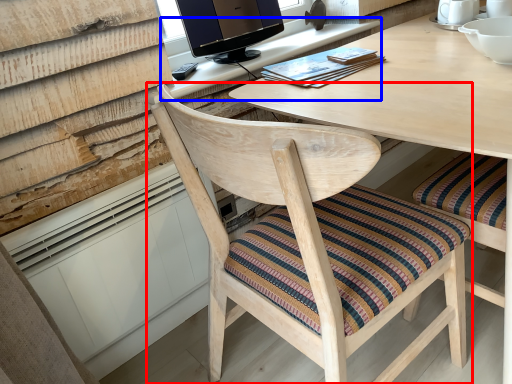
Question: Which object is further to the camera taking this photo, chair (highlighted by a red box) or computer desk (highlighted by a blue box)?

Choices:
 (A) chair
 (B) computer desk

Answer: (B)